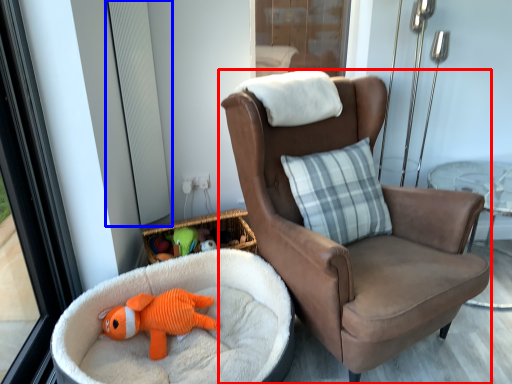
Question: Which object appears closest to the camera in this image, chair (highlighted by a red box) or window screen (highlighted by a blue box)?

Choices:
 (A) chair
 (B) window screen

Answer: (A)